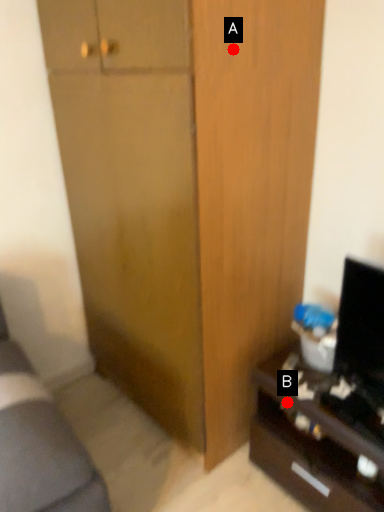
Question: Two points are circled on the image, labeled by A and B beside each circle. Which point appears closest to the camera in this image?

Choices:
 (A) A is closer
 (B) B is closer

Answer: (A)